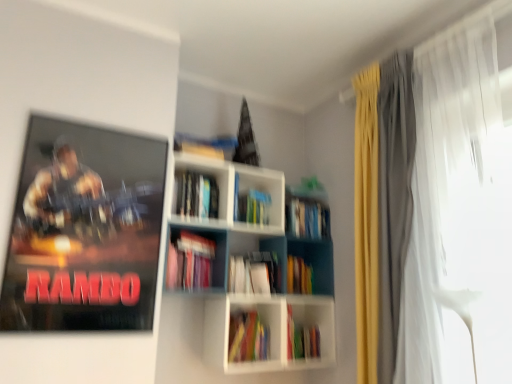
The height and width of the screenshot is (384, 512). Describe the element at coordinates (257, 273) in the screenshot. I see `white plastic bookcase at center` at that location.

Identify the location of white plastic bookcase at center. The height and width of the screenshot is (384, 512). (257, 273).

What do you see at coordinates (84, 230) in the screenshot? I see `metallic rambo poster at upper left` at bounding box center [84, 230].

In order to face multicolored paper at center, marked as the 2th book in a bottom-to-top arrangement, should I rotate leftwards or rightwards?

Turn left approximately 0.169 degrees to face it.

The height and width of the screenshot is (384, 512). Find the location of `matte pink book at center, acting as the 4th book starting from the bottom`. matte pink book at center, acting as the 4th book starting from the bottom is located at coordinates (190, 262).

You are a GUI agent. You are given a task and a screenshot of the screen. Output one action in this format:
    pyautogui.click(x=<x>, y=<y>)
    Task: Click on the white matte bookshelf at center, acting as the first book starting from the top
    
    Given the screenshot: What is the action you would take?
    pyautogui.click(x=196, y=195)

Is hardcover book at center, which is the 5th book from bottom to top, not close to white plastic bookcase at center?

They are positioned close to each other.

Between hardcover book at center, which ranks as the 2th book in top-to-bottom order, and white plastic bookcase at center, which one has more height?

Standing taller between the two is white plastic bookcase at center.

The width and height of the screenshot is (512, 384). Find the location of `bookcase on the left of hardcover book at center, which is the 5th book from bottom to top`. bookcase on the left of hardcover book at center, which is the 5th book from bottom to top is located at coordinates (257, 273).

Looking at this image, which is behind, hardcover book at center, which ranks as the 2th book in top-to-bottom order, or white plastic bookcase at center?

hardcover book at center, which ranks as the 2th book in top-to-bottom order, is more distant.

Is hardcover book at center, which is the 5th book from bottom to top, inside or outside of matte pink book at center, acting as the 4th book starting from the bottom?

hardcover book at center, which is the 5th book from bottom to top, is spatially situated outside matte pink book at center, acting as the 4th book starting from the bottom.

From a real-world perspective, does hardcover book at center, which is the 5th book from bottom to top, sit lower than matte pink book at center, positioned as the third book in top-to-bottom order?

No.

Is hardcover book at center, which ranks as the 2th book in top-to-bottom order, far away from matte pink book at center, acting as the 4th book starting from the bottom?

No.

Is hardcover book at center, which ranks as the 2th book in top-to-bottom order, looking in the opposite direction of matte pink book at center, acting as the 4th book starting from the bottom?

That's not correct — hardcover book at center, which ranks as the 2th book in top-to-bottom order, is not looking away from matte pink book at center, acting as the 4th book starting from the bottom.

In the scene shown: Considering the sizes of objects metallic rambo poster at upper left and multicolored paper book at center, acting as the 4th book starting from the top, in the image provided, who is wider, metallic rambo poster at upper left or multicolored paper book at center, acting as the 4th book starting from the top,?

multicolored paper book at center, acting as the 4th book starting from the top.

Considering the positions of points (86, 240) and (300, 258), is point (86, 240) farther from camera compared to point (300, 258)?

That is False.

Which object is positioned more to the right, metallic rambo poster at upper left or multicolored paper book at center, the 3th book positioned from the bottom?

multicolored paper book at center, the 3th book positioned from the bottom.

Is white matte bookshelf at center, acting as the first book starting from the top, bigger or smaller than metallic rambo poster at upper left?

Clearly, white matte bookshelf at center, acting as the first book starting from the top, is smaller in size than metallic rambo poster at upper left.

Considering the sizes of white matte bookshelf at center, acting as the first book starting from the top, and metallic rambo poster at upper left in the image, is white matte bookshelf at center, acting as the first book starting from the top, wider or thinner than metallic rambo poster at upper left?

Considering their sizes, white matte bookshelf at center, acting as the first book starting from the top, looks broader than metallic rambo poster at upper left.

Locate an element on the screen. movie poster that is below the white matte bookshelf at center, acting as the first book starting from the top (from the image's perspective) is located at coordinates (84, 230).

Is multicolored paper at center, marked as the 2th book in a bottom-to-top arrangement, completely or partially inside matte pink book at center, positioned as the third book in top-to-bottom order?

No, multicolored paper at center, marked as the 2th book in a bottom-to-top arrangement, is not a part of matte pink book at center, positioned as the third book in top-to-bottom order.

Is matte pink book at center, acting as the 4th book starting from the bottom, thinner than multicolored paper at center, marked as the 2th book in a bottom-to-top arrangement?

Correct, the width of matte pink book at center, acting as the 4th book starting from the bottom, is less than that of multicolored paper at center, marked as the 2th book in a bottom-to-top arrangement.

Is matte pink book at center, acting as the 4th book starting from the bottom, far from multicolored paper at center, marked as the 2th book in a bottom-to-top arrangement?

No, matte pink book at center, acting as the 4th book starting from the bottom, is not far from multicolored paper at center, marked as the 2th book in a bottom-to-top arrangement.

Is multicolored paper at center, positioned as the fifth book in top-to-bottom order, looking in the opposite direction of matte pink book at center, acting as the 4th book starting from the bottom?

No.

From the image's perspective, which one is positioned lower, multicolored paper at center, marked as the 2th book in a bottom-to-top arrangement, or matte pink book at center, positioned as the third book in top-to-bottom order?

From the image's view, multicolored paper at center, marked as the 2th book in a bottom-to-top arrangement, is below.

Starting from the matte pink book at center, positioned as the third book in top-to-bottom order, which book is the 1st one behind? Please provide its 2D coordinates.

[(248, 338)]

Are multicolored paper book at center, the 3th book positioned from the bottom, and hardcover book at center, which is the 5th book from bottom to top, far apart?

That's not correct — multicolored paper book at center, the 3th book positioned from the bottom, is a little close to hardcover book at center, which is the 5th book from bottom to top.

Is point (309, 289) more distant than point (304, 200)?

Yes, point (309, 289) is farther from viewer.

From a real-world perspective, which book is the 1st one above the multicolored paper book at center, acting as the 4th book starting from the top? Please provide its 2D coordinates.

[(307, 219)]

Which object is more forward, multicolored paper book at center, acting as the 4th book starting from the top, or hardcover book at center, which is the 5th book from bottom to top?

hardcover book at center, which is the 5th book from bottom to top, is closer to the camera.

What are the coordinates of `book that is the 1st object above the white plastic bookcase at center (from a real-world perspective)` in the screenshot? It's located at (307, 219).

From the hardcover book at center, which is the 5th book from bottom to top, count the 3rd book to the left and point to it. Please provide its 2D coordinates.

[(190, 262)]

When comparing their distances from multicolored paper book at center, the 3th book positioned from the bottom, does white sheer curtain at right or matte pink book at center, acting as the 4th book starting from the bottom, seem closer?

matte pink book at center, acting as the 4th book starting from the bottom.

Based on their spatial positions, is white matte bookshelf at center, acting as the 6th book starting from the bottom, or white sheer curtain at right further from multicolored paper book at center, the 3th book positioned from the bottom?

white sheer curtain at right is positioned further to the anchor multicolored paper book at center, the 3th book positioned from the bottom.

Looking at the image, which one is located closer to multicolored paper at center, positioned as the fifth book in top-to-bottom order, white plastic bookcase at center or matte pink book at center, positioned as the third book in top-to-bottom order?

Among the two, white plastic bookcase at center is located nearer to multicolored paper at center, positioned as the fifth book in top-to-bottom order.

Estimate the real-world distances between objects in this image. Which object is further from matte pink book at center, positioned as the third book in top-to-bottom order, hardcover book at center, which is the 5th book from bottom to top, or multicolored paper at center, positioned as the sixth book in top-to-bottom order?

multicolored paper at center, positioned as the sixth book in top-to-bottom order, is further to matte pink book at center, positioned as the third book in top-to-bottom order.

Which object lies further to the anchor point white matte bookshelf at center, acting as the first book starting from the top, hardcover book at center, which is the 5th book from bottom to top, or white plastic bookcase at center?

hardcover book at center, which is the 5th book from bottom to top, lies further to white matte bookshelf at center, acting as the first book starting from the top, than the other object.

Which object lies nearer to the anchor point metallic rambo poster at upper left, hardcover book at center, which ranks as the 2th book in top-to-bottom order, or white sheer curtain at right?

hardcover book at center, which ranks as the 2th book in top-to-bottom order, lies closer to metallic rambo poster at upper left than the other object.

From the image, which object appears to be nearer to white matte bookshelf at center, acting as the 6th book starting from the bottom, white sheer curtain at right or matte pink book at center, positioned as the third book in top-to-bottom order?

The object closer to white matte bookshelf at center, acting as the 6th book starting from the bottom, is matte pink book at center, positioned as the third book in top-to-bottom order.

Considering their positions, is metallic rambo poster at upper left positioned further to white plastic bookcase at center than white matte bookshelf at center, acting as the first book starting from the top?

The object further to white plastic bookcase at center is metallic rambo poster at upper left.

The image size is (512, 384). Find the location of `bookcase between metallic rambo poster at upper left and multicolored paper at center, marked as the 2th book in a bottom-to-top arrangement, in the horizontal direction`. bookcase between metallic rambo poster at upper left and multicolored paper at center, marked as the 2th book in a bottom-to-top arrangement, in the horizontal direction is located at coordinates (257, 273).

Locate an element on the screen. This screenshot has height=384, width=512. bookcase between matte pink book at center, positioned as the third book in top-to-bottom order, and hardcover book at center, which ranks as the 2th book in top-to-bottom order, from left to right is located at coordinates (257, 273).

Locate an element on the screen. bookcase between hardcover book at center, which ranks as the 2th book in top-to-bottom order, and multicolored paper at center, positioned as the fifth book in top-to-bottom order, from top to bottom is located at coordinates (257, 273).

The height and width of the screenshot is (384, 512). I want to click on bookcase between hardcover book at center, which ranks as the 2th book in top-to-bottom order, and multicolored paper at center, placed as the first book when sorted from bottom to top, vertically, so click(x=257, y=273).